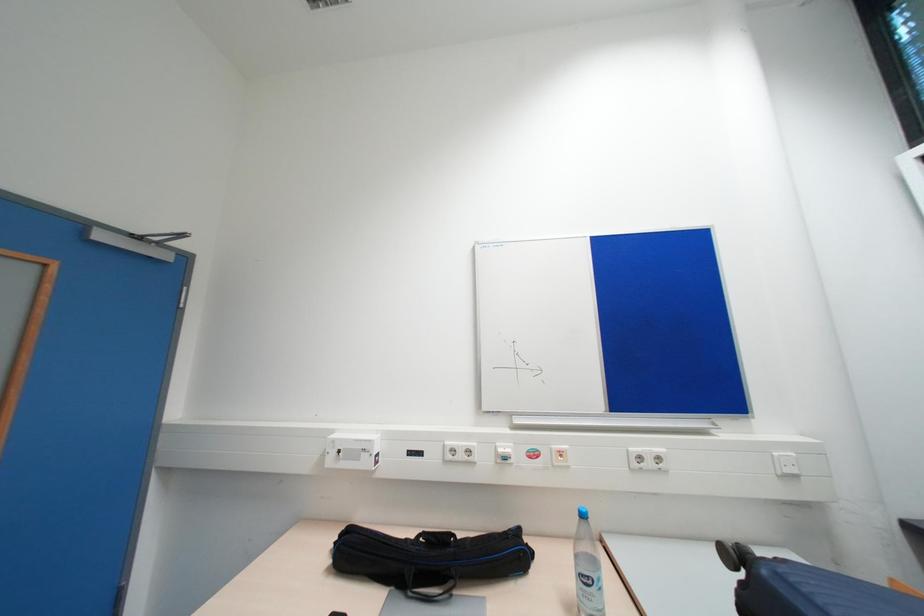
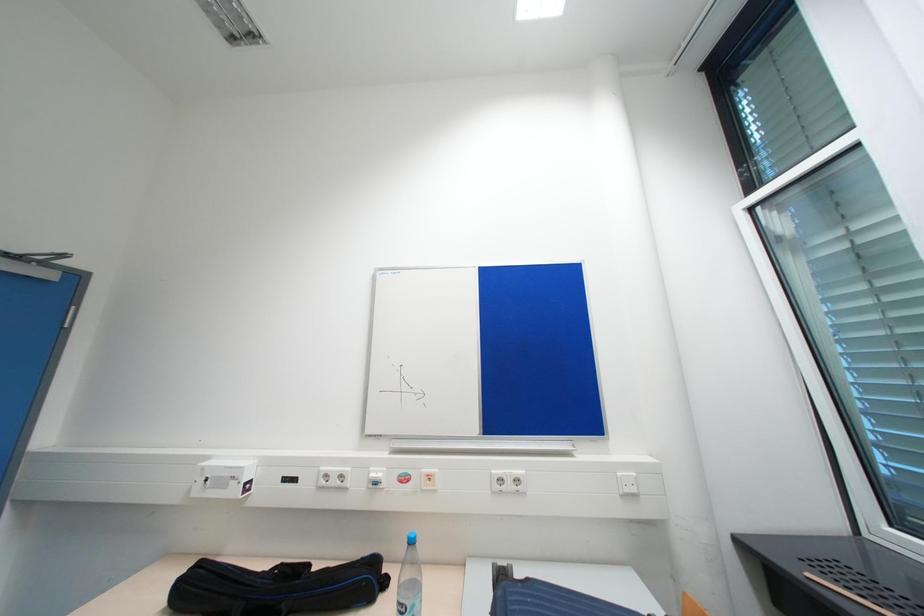
Question: Based on the continuous images, in which direction is the camera rotating? Reply with the corresponding letter.

Choices:
 (A) Left
 (B) Right
 (C) Up
 (D) Down

Answer: (B)